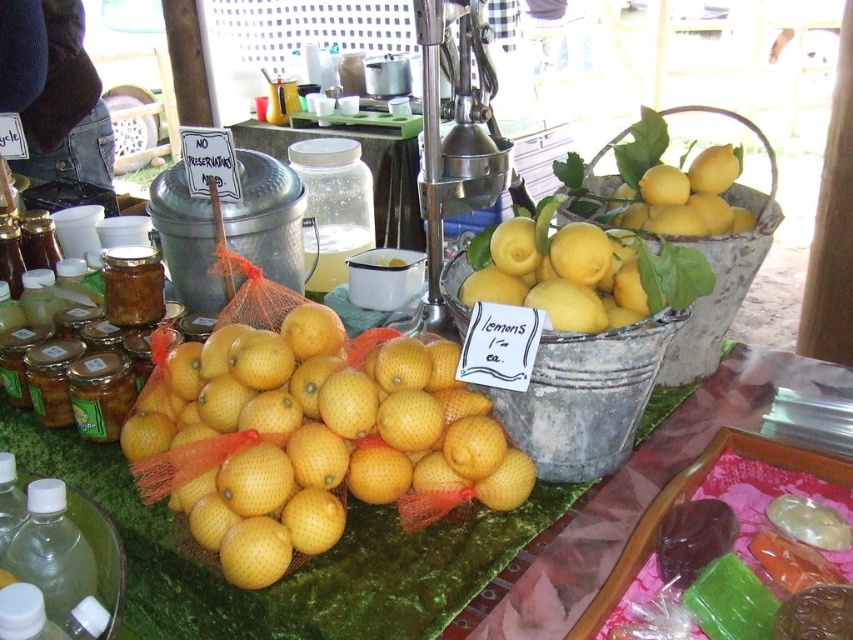
You are a customer at the market stall and want to buy both the yellow matte lemons at center and the clear glass jar at center. If you place them side by side on your shopping bag, which one will occupy more space horizontally?

The yellow matte lemons at center are wider than the clear glass jar at center, so they will occupy more horizontal space when placed side by side.

You are a customer at the market stall and want to place an order. You have a small basket that can only hold items within 8 inches of each other. If you want to buy both the yellow matte lemons at center and the clear plastic bottle at lower left, will they fit in your basket?

The distance between the yellow matte lemons at center and the clear plastic bottle at lower left is 8.23 inches. Since your basket can only hold items within 8 inches of each other, they will not fit together in the basket.

You are a customer at the market stall and want to buy the taller item between the clear glass jar at center and the clear plastic bottle at lower left. Which one should you choose?

The clear glass jar at center is taller than the clear plastic bottle at lower left, so you should choose the clear glass jar at center.